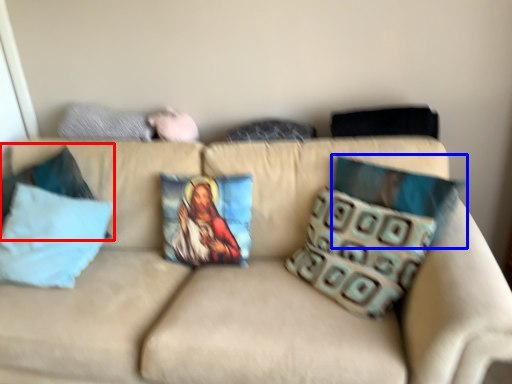
Question: Among these objects, which one is nearest to the camera, pillow (highlighted by a red box) or pillow (highlighted by a blue box)?

Choices:
 (A) pillow
 (B) pillow

Answer: (B)